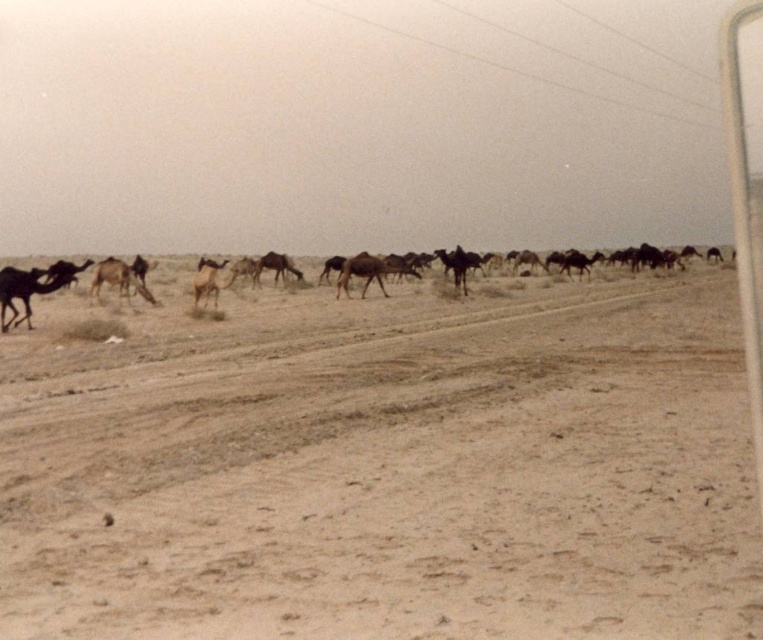
Can you confirm if brown matte camel at left is smaller than brown fuzzy camel at center-left?

Yes, brown matte camel at left is smaller than brown fuzzy camel at center-left.

Measure the distance between brown matte camel at left and camera.

The distance of brown matte camel at left from camera is 74.06 feet.

Locate an element on the screen. The height and width of the screenshot is (640, 763). brown matte camel at left is located at coordinates (31, 288).

Does brown sandy dirt field at center have a lesser width compared to brown matte camel at left?

No.

Who is positioned more to the right, brown sandy dirt field at center or brown matte camel at left?

brown sandy dirt field at center is more to the right.

What do you see at coordinates (382, 465) in the screenshot? I see `brown sandy dirt field at center` at bounding box center [382, 465].

Identify the location of brown sandy dirt field at center. [382, 465].

Does brown matte camel at left have a smaller size compared to brown matte camel at center?

Yes.

Between brown matte camel at left and brown matte camel at center, which one appears on the left side from the viewer's perspective?

From the viewer's perspective, brown matte camel at left appears more on the left side.

Which is in front, point (21, 298) or point (285, 257)?

Point (21, 298) is in front.

Locate an element on the screen. brown matte camel at left is located at coordinates (31, 288).